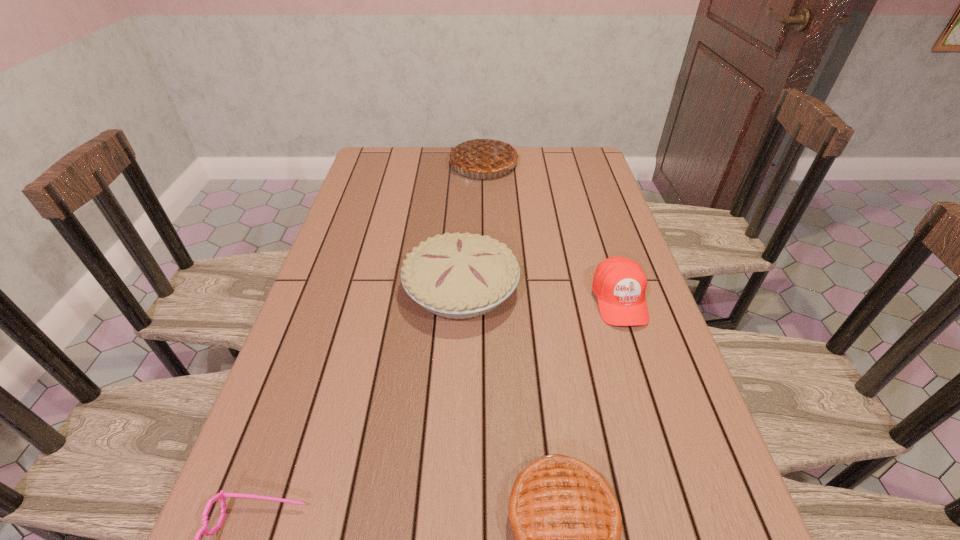
Where is `the farthest object`? The width and height of the screenshot is (960, 540). the farthest object is located at coordinates (485, 154).

Locate an element on the screen. This screenshot has width=960, height=540. the farthest pie is located at coordinates (485, 154).

Where is `the second farthest pie`? Image resolution: width=960 pixels, height=540 pixels. the second farthest pie is located at coordinates (457, 276).

Locate an element on the screen. This screenshot has width=960, height=540. baseball cap is located at coordinates pyautogui.click(x=619, y=283).

Image resolution: width=960 pixels, height=540 pixels. I want to click on free space located 0.130m on the front of the tallest pie, so click(x=485, y=203).

Locate an element on the screen. vacant space located 0.100m on the right of the second tallest pie is located at coordinates (558, 288).

Locate an element on the screen. The width and height of the screenshot is (960, 540). free space located on the front panel of the baseball cap is located at coordinates (671, 461).

Image resolution: width=960 pixels, height=540 pixels. Identify the location of object positioned at the far edge. (485, 154).

The height and width of the screenshot is (540, 960). I want to click on object that is at the right edge, so click(x=619, y=283).

Identify the location of vacant region at the far edge. (415, 160).